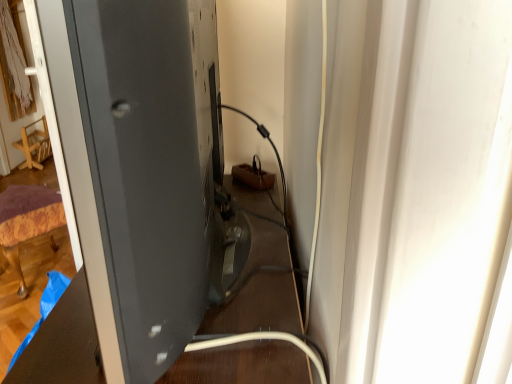
Question: Is matte black monitor at left closer to camera compared to velvet purple ottoman at lower left, which is counted as the second furniture, starting from the back?

Choices:
 (A) yes
 (B) no

Answer: (A)

Question: Would you say matte black monitor at left is a long distance from velvet purple ottoman at lower left, which is counted as the second furniture, starting from the back?

Choices:
 (A) yes
 (B) no

Answer: (A)

Question: From the image's perspective, would you say matte black monitor at left is positioned over velvet purple ottoman at lower left, arranged as the 1th furniture when viewed from the right?

Choices:
 (A) no
 (B) yes

Answer: (B)

Question: Is matte black monitor at left located outside velvet purple ottoman at lower left, which ranks as the 2th furniture in top-to-bottom order?

Choices:
 (A) yes
 (B) no

Answer: (A)

Question: Can you confirm if matte black monitor at left is bigger than velvet purple ottoman at lower left, arranged as the 1th furniture when viewed from the right?

Choices:
 (A) no
 (B) yes

Answer: (B)

Question: Does matte black monitor at left come behind velvet purple ottoman at lower left, arranged as the 1th furniture when viewed from the right?

Choices:
 (A) yes
 (B) no

Answer: (B)

Question: Considering the relative sizes of wooden chair at left, which ranks as the second furniture in bottom-to-top order, and velvet purple ottoman at lower left, which is counted as the second furniture, starting from the left, in the image provided, is wooden chair at left, which ranks as the second furniture in bottom-to-top order, smaller than velvet purple ottoman at lower left, which is counted as the second furniture, starting from the left,?

Choices:
 (A) no
 (B) yes

Answer: (B)

Question: Does wooden chair at left, which ranks as the second furniture in bottom-to-top order, turn towards velvet purple ottoman at lower left, which ranks as the 2th furniture in top-to-bottom order?

Choices:
 (A) no
 (B) yes

Answer: (A)

Question: Is wooden chair at left, acting as the first furniture starting from the back, outside velvet purple ottoman at lower left, placed as the first furniture when sorted from front to back?

Choices:
 (A) yes
 (B) no

Answer: (A)

Question: Is wooden chair at left, which ranks as the second furniture in bottom-to-top order, far away from velvet purple ottoman at lower left, positioned as the first furniture in bottom-to-top order?

Choices:
 (A) no
 (B) yes

Answer: (B)

Question: Is wooden chair at left, the 2th furniture viewed from the front, taller than velvet purple ottoman at lower left, positioned as the first furniture in bottom-to-top order?

Choices:
 (A) yes
 (B) no

Answer: (B)

Question: Considering the relative sizes of wooden chair at left, the 1th furniture from the left, and velvet purple ottoman at lower left, arranged as the 1th furniture when viewed from the right, in the image provided, is wooden chair at left, the 1th furniture from the left, shorter than velvet purple ottoman at lower left, arranged as the 1th furniture when viewed from the right,?

Choices:
 (A) yes
 (B) no

Answer: (A)

Question: Is velvet purple ottoman at lower left, positioned as the first furniture in bottom-to-top order, directly adjacent to matte black monitor at left?

Choices:
 (A) yes
 (B) no

Answer: (B)